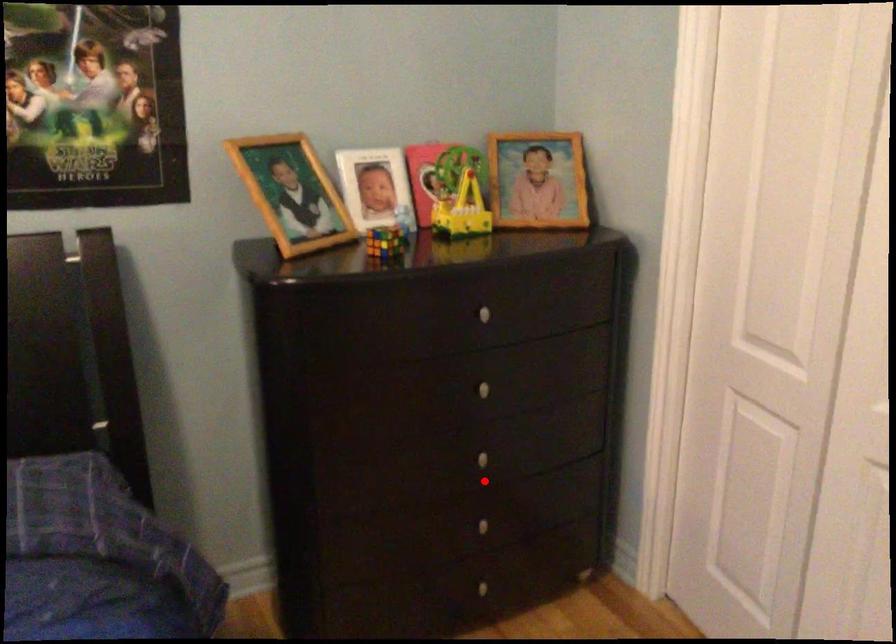
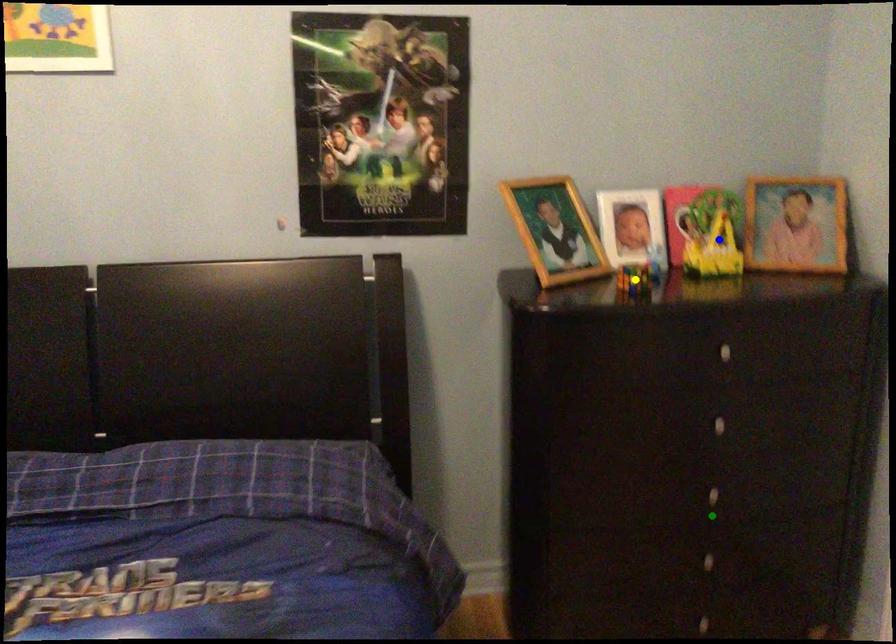
Question: I am providing you with two images of the same scene from different viewpoints. A red point is marked on the first image. You are given multiple points on the second image. Can you choose the point in image 2 that corresponds to the point in image 1?

Choices:
 (A) yellow point
 (B) green point
 (C) blue point

Answer: (B)